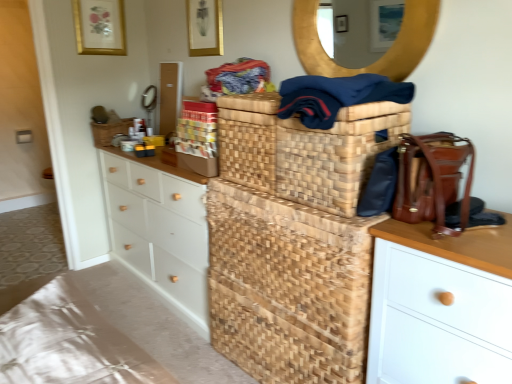
Question: From the image's perspective, is matte gold picture frame at upper center, positioned as the 2th picture frame in front-to-back order, located above woven brown basket at center, which appears as the first basket when viewed from the left?

Choices:
 (A) yes
 (B) no

Answer: (A)

Question: Is matte gold picture frame at upper center, arranged as the 1th picture frame when viewed from the back, smaller than woven brown basket at center, placed as the 1th basket when sorted from top to bottom?

Choices:
 (A) no
 (B) yes

Answer: (B)

Question: Can you confirm if matte gold picture frame at upper center, positioned as the 2th picture frame in front-to-back order, is bigger than woven brown basket at center, placed as the 1th basket when sorted from top to bottom?

Choices:
 (A) no
 (B) yes

Answer: (A)

Question: Considering the relative sizes of matte gold picture frame at upper center, positioned as the 2th picture frame in front-to-back order, and woven brown basket at center, which appears as the first basket when viewed from the left, in the image provided, is matte gold picture frame at upper center, positioned as the 2th picture frame in front-to-back order, thinner than woven brown basket at center, which appears as the first basket when viewed from the left,?

Choices:
 (A) yes
 (B) no

Answer: (A)

Question: Could you tell me if matte gold picture frame at upper center, arranged as the 1th picture frame when viewed from the back, is turned towards woven brown basket at center, placed as the second basket when sorted from right to left?

Choices:
 (A) yes
 (B) no

Answer: (B)

Question: From a real-world perspective, is matte gold picture frame at upper center, arranged as the 1th picture frame when viewed from the back, located higher than woven brown basket at center, placed as the second basket when sorted from right to left?

Choices:
 (A) no
 (B) yes

Answer: (B)

Question: Is natural woven basket at center oriented away from woven brown basket at center, placed as the 1th basket when sorted from top to bottom?

Choices:
 (A) yes
 (B) no

Answer: (B)

Question: Does natural woven basket at center have a lesser height compared to woven brown basket at center, which appears as the first basket when viewed from the left?

Choices:
 (A) yes
 (B) no

Answer: (B)

Question: From the image's perspective, is natural woven basket at center located above woven brown basket at center, the 2th basket when ordered from bottom to top?

Choices:
 (A) no
 (B) yes

Answer: (A)

Question: From a real-world perspective, is natural woven basket at center positioned under woven brown basket at center, the 2th basket when ordered from bottom to top, based on gravity?

Choices:
 (A) no
 (B) yes

Answer: (B)

Question: Are natural woven basket at center and woven brown basket at center, which appears as the first basket when viewed from the left, beside each other?

Choices:
 (A) no
 (B) yes

Answer: (A)

Question: Considering the relative sizes of natural woven basket at center and woven brown basket at center, which appears as the first basket when viewed from the left, in the image provided, is natural woven basket at center thinner than woven brown basket at center, which appears as the first basket when viewed from the left,?

Choices:
 (A) no
 (B) yes

Answer: (A)

Question: Does matte gold picture frame at upper center, which is counted as the 1th picture frame, starting from the front, turn towards matte gold picture frame at upper center, positioned as the 2th picture frame in front-to-back order?

Choices:
 (A) no
 (B) yes

Answer: (A)